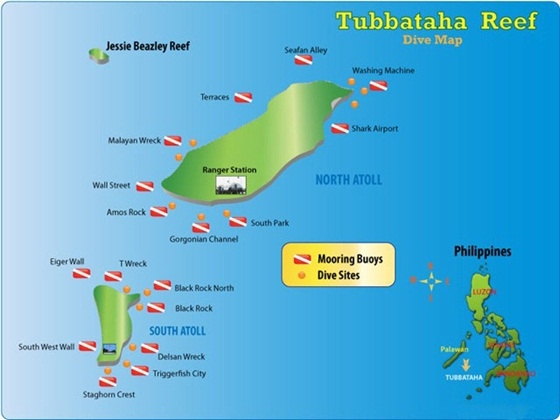
Where is `south west wall`? south west wall is located at coordinates (18, 344).